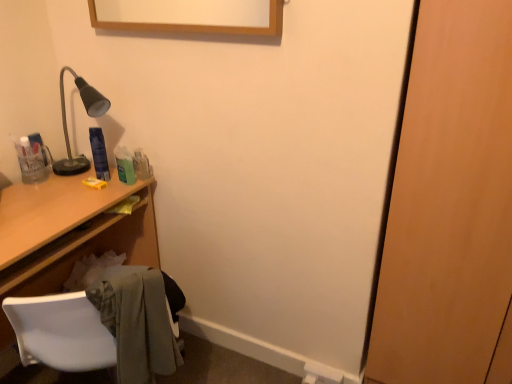
I want to click on vacant region to the left of blue plastic can at upper left, so click(58, 172).